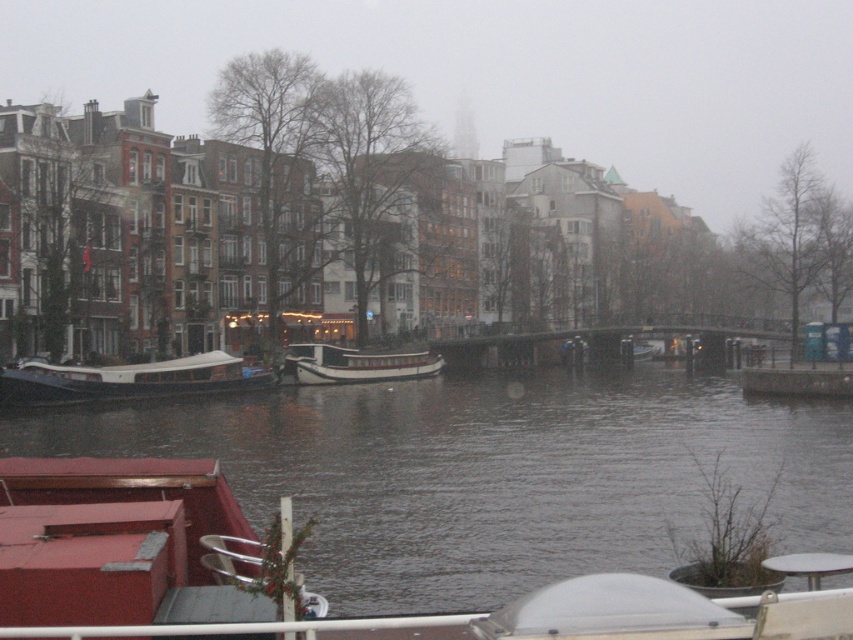
Locate an element on the screen. This screenshot has width=853, height=640. dark gray water at center is located at coordinates (486, 474).

Is dark gray water at center positioned behind white wooden boat at center?

That is False.

Locate an element on the screen. This screenshot has width=853, height=640. dark gray water at center is located at coordinates (486, 474).

Locate an element on the screen. The height and width of the screenshot is (640, 853). dark gray water at center is located at coordinates (486, 474).

Is point (71, 388) in front of point (315, 352)?

Yes, it is.

Which is above, wooden polished boat at left or white wooden boat at center?

white wooden boat at center is above.

Which is behind, point (154, 392) or point (328, 364)?

Point (328, 364)

What are the coordinates of `wooden polished boat at left` in the screenshot? It's located at (129, 380).

Can you confirm if dark gray water at center is positioned to the right of wooden polished boat at left?

Correct, you'll find dark gray water at center to the right of wooden polished boat at left.

Can you confirm if dark gray water at center is positioned below wooden polished boat at left?

Yes, dark gray water at center is below wooden polished boat at left.

I want to click on dark gray water at center, so click(x=486, y=474).